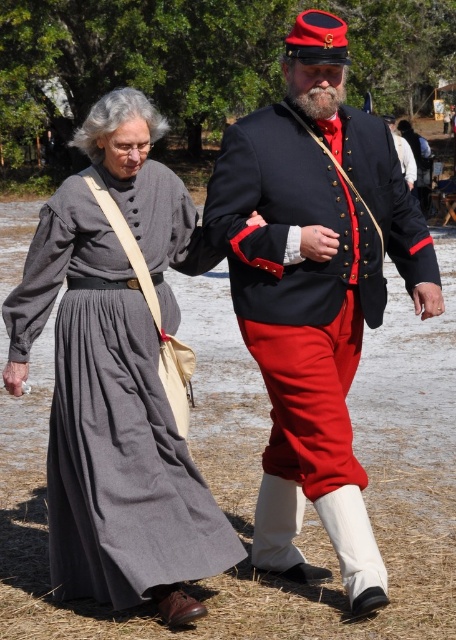
Looking at this image, you are organizing a historical reenactment event and need to ensure that the shiny black coat at center and the gray cotton dress at left can be displayed side by side in a narrow exhibition space. Given their sizes, will both items fit without overlapping?

The shiny black coat at center is larger in size than the gray cotton dress at left. Since the coat is bigger, they might not fit side by side in a narrow space without overlapping. You should check the exact dimensions to confirm.